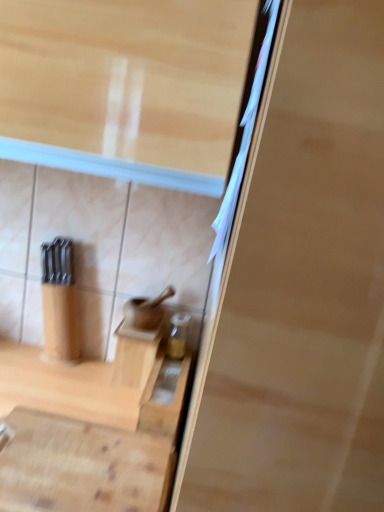
This screenshot has height=512, width=384. What do you see at coordinates (82, 466) in the screenshot?
I see `wooden cutting board at lower center, the second cabinetry viewed from the back` at bounding box center [82, 466].

At what (x,y) coordinates should I click in order to perform the action: click on wooden cutting board at lower center, the second cabinetry viewed from the back. Please return your answer as a coordinate pair (x, y). Looking at the image, I should click on (82, 466).

Where is `wooden cabinet at center, the second cabinetry when ordered from front to back`? The height and width of the screenshot is (512, 384). wooden cabinet at center, the second cabinetry when ordered from front to back is located at coordinates (134, 354).

Describe the element at coordinates (134, 354) in the screenshot. I see `wooden cabinet at center, the second cabinetry when ordered from front to back` at that location.

In order to click on wooden cutting board at lower center, the second cabinetry viewed from the back in this screenshot , I will do `click(82, 466)`.

Which is more to the left, wooden cutting board at lower center, the first cabinetry in the front-to-back sequence, or wooden cabinet at center, the second cabinetry when ordered from front to back?

Positioned to the left is wooden cutting board at lower center, the first cabinetry in the front-to-back sequence.

Which object is more forward, wooden cutting board at lower center, the second cabinetry viewed from the back, or wooden cabinet at center, acting as the 1th cabinetry starting from the back?

wooden cutting board at lower center, the second cabinetry viewed from the back, is in front.

Considering the positions of points (160, 490) and (147, 360), is point (160, 490) farther from camera compared to point (147, 360)?

No, (160, 490) is in front of (147, 360).

From the image's perspective, is wooden cutting board at lower center, the second cabinetry viewed from the back, on wooden cabinet at center, acting as the 1th cabinetry starting from the back?

Incorrect, from the image's perspective, wooden cutting board at lower center, the second cabinetry viewed from the back, is lower than wooden cabinet at center, acting as the 1th cabinetry starting from the back.

From a real-world perspective, which object rests below the other?

wooden cutting board at lower center, the first cabinetry in the front-to-back sequence, from a real-world perspective.

Considering the relative sizes of wooden cutting board at lower center, the second cabinetry viewed from the back, and wooden cabinet at center, the second cabinetry when ordered from front to back, in the image provided, is wooden cutting board at lower center, the second cabinetry viewed from the back, wider than wooden cabinet at center, the second cabinetry when ordered from front to back,?

Yes.

Which of these two, wooden cutting board at lower center, the second cabinetry viewed from the back, or wooden cabinet at center, acting as the 1th cabinetry starting from the back, stands shorter?

With less height is wooden cutting board at lower center, the second cabinetry viewed from the back.

Is wooden cutting board at lower center, the second cabinetry viewed from the back, smaller than wooden cabinet at center, the second cabinetry when ordered from front to back?

No.

Is wooden cutting board at lower center, the second cabinetry viewed from the back, spatially inside wooden cabinet at center, the second cabinetry when ordered from front to back, or outside of it?

wooden cutting board at lower center, the second cabinetry viewed from the back, cannot be found inside wooden cabinet at center, the second cabinetry when ordered from front to back.

Is wooden cutting board at lower center, the first cabinetry in the front-to-back sequence, not near wooden cabinet at center, acting as the 1th cabinetry starting from the back?

They are positioned close to each other.

Consider the image. Could you tell me if wooden cutting board at lower center, the second cabinetry viewed from the back, is turned towards wooden cabinet at center, the second cabinetry when ordered from front to back?

No, wooden cutting board at lower center, the second cabinetry viewed from the back, is not aimed at wooden cabinet at center, the second cabinetry when ordered from front to back.

Consider the image. Can you tell me how much wooden cutting board at lower center, the second cabinetry viewed from the back, and wooden cabinet at center, acting as the 1th cabinetry starting from the back, differ in facing direction?

1.23 degrees.

This screenshot has width=384, height=512. In order to click on cabinetry positioned vertically above the wooden cutting board at lower center, the second cabinetry viewed from the back (from a real-world perspective) in this screenshot , I will do `click(134, 354)`.

Considering the positions of objects wooden cabinet at center, acting as the 1th cabinetry starting from the back, and wooden cutting board at lower center, the second cabinetry viewed from the back, in the image provided, who is more to the left, wooden cabinet at center, acting as the 1th cabinetry starting from the back, or wooden cutting board at lower center, the second cabinetry viewed from the back,?

wooden cutting board at lower center, the second cabinetry viewed from the back.

Is wooden cabinet at center, the second cabinetry when ordered from front to back, positioned behind wooden cutting board at lower center, the second cabinetry viewed from the back?

That is True.

Is point (137, 342) behind point (94, 501)?

Yes, point (137, 342) is behind point (94, 501).

From the image's perspective, who appears lower, wooden cabinet at center, acting as the 1th cabinetry starting from the back, or wooden cutting board at lower center, the second cabinetry viewed from the back?

wooden cutting board at lower center, the second cabinetry viewed from the back, is shown below in the image.

From a real-world perspective, which object rests below the other?

wooden cutting board at lower center, the first cabinetry in the front-to-back sequence, from a real-world perspective.

Considering the relative sizes of wooden cabinet at center, the second cabinetry when ordered from front to back, and wooden cutting board at lower center, the second cabinetry viewed from the back, in the image provided, is wooden cabinet at center, the second cabinetry when ordered from front to back, wider than wooden cutting board at lower center, the second cabinetry viewed from the back,?

In fact, wooden cabinet at center, the second cabinetry when ordered from front to back, might be narrower than wooden cutting board at lower center, the second cabinetry viewed from the back.

Which of these two, wooden cabinet at center, the second cabinetry when ordered from front to back, or wooden cutting board at lower center, the first cabinetry in the front-to-back sequence, stands shorter?

With less height is wooden cutting board at lower center, the first cabinetry in the front-to-back sequence.

Can you confirm if wooden cabinet at center, acting as the 1th cabinetry starting from the back, is smaller than wooden cutting board at lower center, the first cabinetry in the front-to-back sequence?

Result: Yes.

Which is correct: wooden cabinet at center, the second cabinetry when ordered from front to back, is inside wooden cutting board at lower center, the second cabinetry viewed from the back, or outside of it?

wooden cabinet at center, the second cabinetry when ordered from front to back, exists outside the volume of wooden cutting board at lower center, the second cabinetry viewed from the back.

Is wooden cabinet at center, the second cabinetry when ordered from front to back, positioned far away from wooden cutting board at lower center, the first cabinetry in the front-to-back sequence?

Actually, wooden cabinet at center, the second cabinetry when ordered from front to back, and wooden cutting board at lower center, the first cabinetry in the front-to-back sequence, are a little close together.

Is wooden cabinet at center, acting as the 1th cabinetry starting from the back, positioned with its back to wooden cutting board at lower center, the second cabinetry viewed from the back?

No.

What's the angular difference between wooden cabinet at center, the second cabinetry when ordered from front to back, and wooden cutting board at lower center, the first cabinetry in the front-to-back sequence,'s facing directions?

wooden cabinet at center, the second cabinetry when ordered from front to back, and wooden cutting board at lower center, the first cabinetry in the front-to-back sequence, are facing 1.23 degrees away from each other.

The image size is (384, 512). Find the location of `cabinetry in front of the wooden cabinet at center, the second cabinetry when ordered from front to back`. cabinetry in front of the wooden cabinet at center, the second cabinetry when ordered from front to back is located at coordinates (82, 466).

This screenshot has height=512, width=384. I want to click on cabinetry above the wooden cutting board at lower center, the first cabinetry in the front-to-back sequence (from the image's perspective), so click(x=134, y=354).

Identify the location of cabinetry that appears on the left of wooden cabinet at center, the second cabinetry when ordered from front to back. (82, 466).